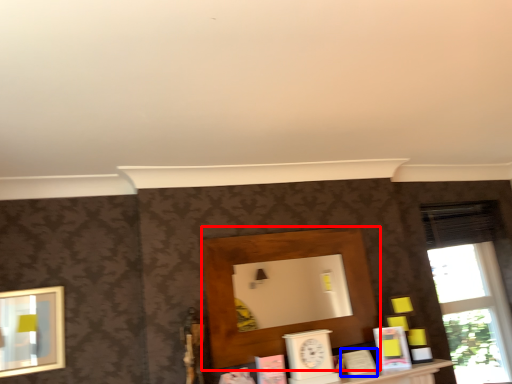
Question: Which point is further to the camera, shelf (highlighted by a red box) or book (highlighted by a blue box)?

Choices:
 (A) shelf
 (B) book

Answer: (B)